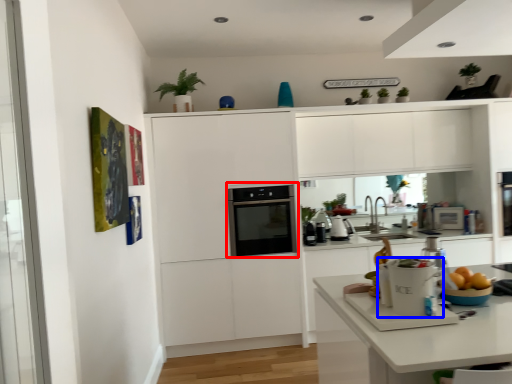
Question: Among these objects, which one is farthest to the camera, home appliance (highlighted by a red box) or kitchen appliance (highlighted by a blue box)?

Choices:
 (A) home appliance
 (B) kitchen appliance

Answer: (A)